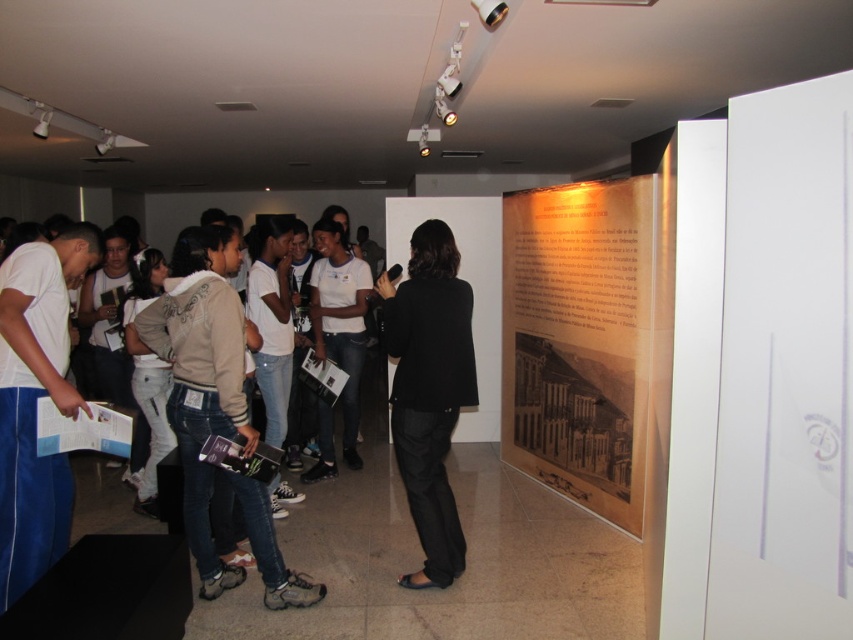
You are an event planner trying to hang a new banner that requires at least 2 meters of vertical space. You see the brown paper poster at center and the black matte blazer at center in the scene. Which object can you use to determine if the space is sufficient?

The brown paper poster at center is taller than the black matte blazer at center. Since the poster is taller, measuring its height would help determine if the required 2 meters of vertical space is available.

You are a visitor in the museum and want to read the text on the brown paper poster at center and the black matte blazer at center. Which one do you think you can read more easily?

The brown paper poster at center is larger in size than the black matte blazer at center, so you can read the text on the brown paper poster at center more easily.

Looking at this image, you are standing in the museum and want to take a photo of both the point at coordinates (618,236) and the point at coordinates (463,563). Which point should you focus on first to ensure both are in focus?

You should focus on the point at coordinates (618,236) first because it is further away from the camera than the point at coordinates (463,563). By focusing on the farther point, the closer point will also be in focus due to the depth of field.